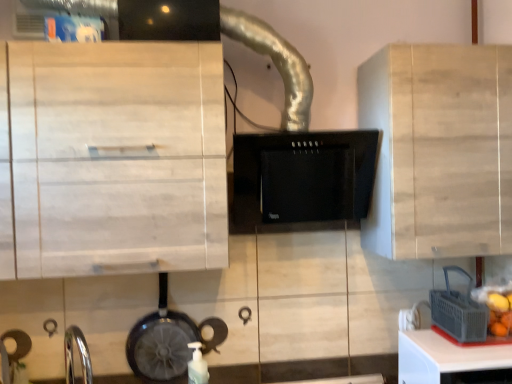
Question: Is light wood cabinet at upper left, placed as the first cabinetry when sorted from left to right, oriented away from white plastic table at lower right?

Choices:
 (A) no
 (B) yes

Answer: (A)

Question: Can you confirm if light wood cabinet at upper left, placed as the first cabinetry when sorted from left to right, is positioned to the right of white plastic table at lower right?

Choices:
 (A) yes
 (B) no

Answer: (B)

Question: Is light wood cabinet at upper left, which ranks as the second cabinetry in right-to-left order, wider than white plastic table at lower right?

Choices:
 (A) no
 (B) yes

Answer: (B)

Question: From a real-world perspective, does light wood cabinet at upper left, placed as the first cabinetry when sorted from left to right, stand above white plastic table at lower right?

Choices:
 (A) no
 (B) yes

Answer: (B)

Question: Is light wood cabinet at upper left, placed as the first cabinetry when sorted from left to right, positioned before white plastic table at lower right?

Choices:
 (A) yes
 (B) no

Answer: (A)

Question: Is light wood cabinet at upper left, placed as the first cabinetry when sorted from left to right, wider or thinner than gray plastic basket at lower right?

Choices:
 (A) wide
 (B) thin

Answer: (A)

Question: From the image's perspective, relative to gray plastic basket at lower right, is light wood cabinet at upper left, which ranks as the second cabinetry in right-to-left order, above or below?

Choices:
 (A) below
 (B) above

Answer: (B)

Question: Is light wood cabinet at upper left, which ranks as the second cabinetry in right-to-left order, spatially inside gray plastic basket at lower right, or outside of it?

Choices:
 (A) inside
 (B) outside

Answer: (B)

Question: In terms of height, does light wood cabinet at upper left, placed as the first cabinetry when sorted from left to right, look taller or shorter compared to gray plastic basket at lower right?

Choices:
 (A) tall
 (B) short

Answer: (A)

Question: From a real-world perspective, is gray plastic basket at lower right physically located above or below shiny black frying pan at lower left?

Choices:
 (A) below
 (B) above

Answer: (B)

Question: Is gray plastic basket at lower right situated inside shiny black frying pan at lower left or outside?

Choices:
 (A) outside
 (B) inside

Answer: (A)

Question: Looking at their shapes, would you say gray plastic basket at lower right is wider or thinner than shiny black frying pan at lower left?

Choices:
 (A) thin
 (B) wide

Answer: (B)

Question: Based on their positions, is gray plastic basket at lower right located to the left or right of shiny black frying pan at lower left?

Choices:
 (A) left
 (B) right

Answer: (B)

Question: From a real-world perspective, relative to black matte range hood at center, is white matte bottle at lower center vertically above or below?

Choices:
 (A) below
 (B) above

Answer: (A)

Question: Considering their positions, is white matte bottle at lower center located in front of or behind black matte range hood at center?

Choices:
 (A) behind
 (B) front

Answer: (A)